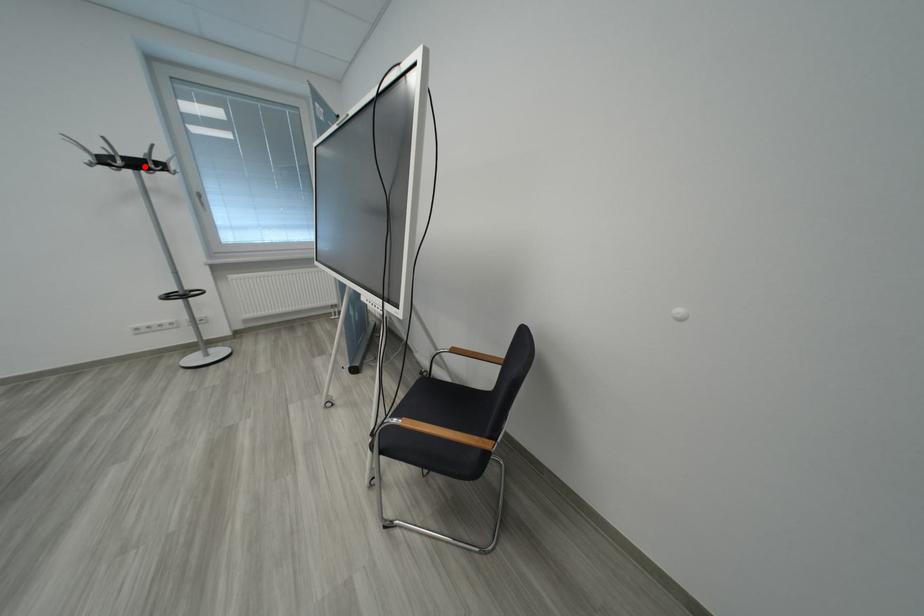
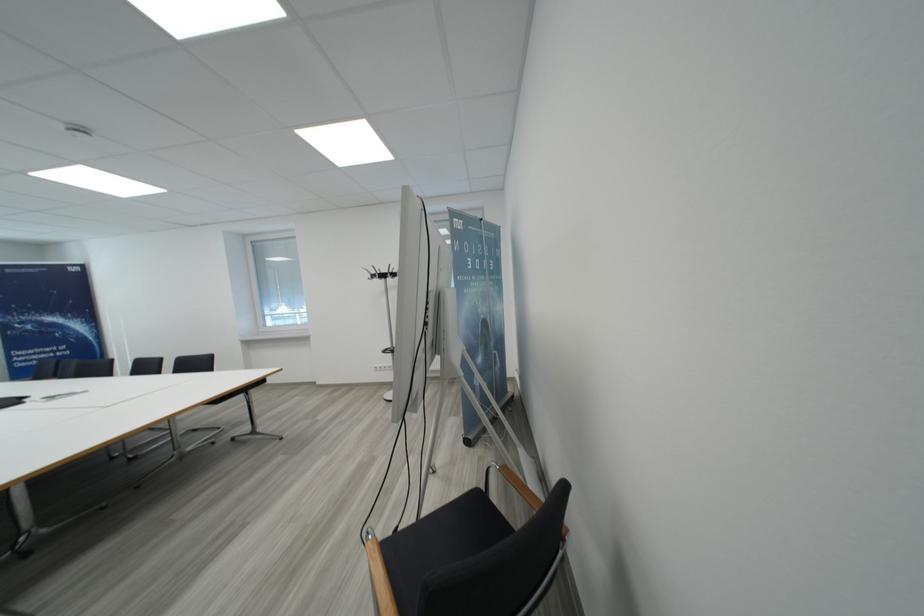
The point at the highlighted location is marked in the first image. Where is the corresponding point in the second image?

(390, 278)